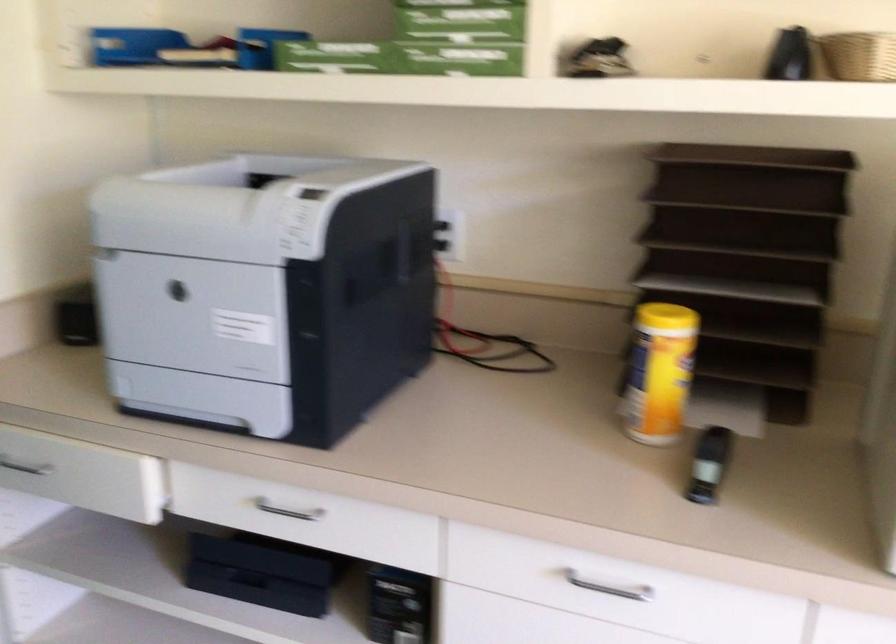
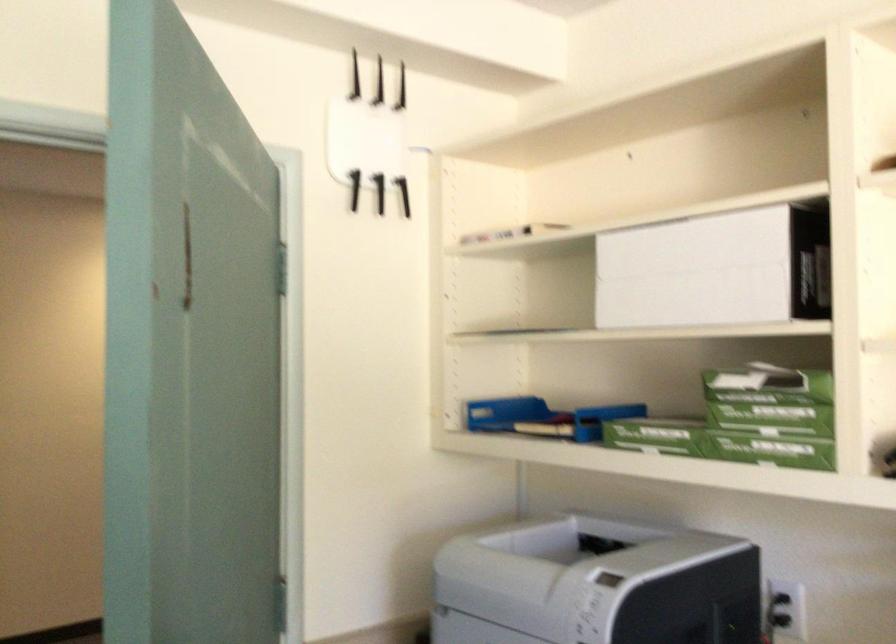
The point at [444,225] is marked in the first image. Where is the corresponding point in the second image?

(782, 609)